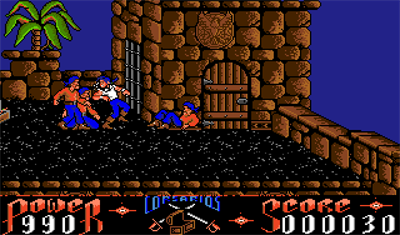
This screenshot has width=400, height=235. What are the coordinates of `score display` in the screenshot? It's located at (315, 205), (325, 223), (366, 223).